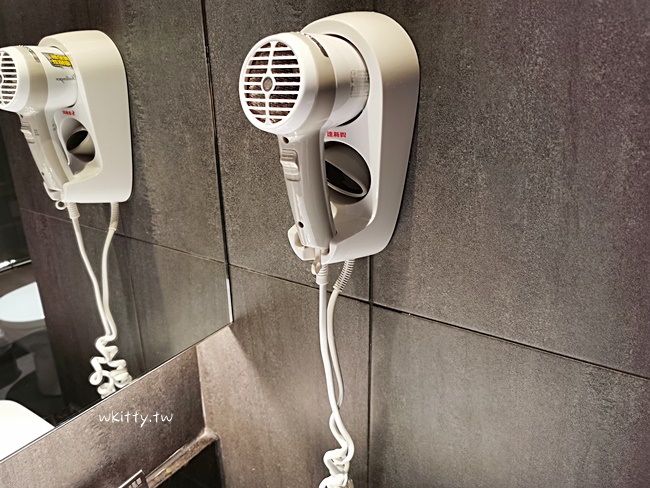
Where is `tiles on wall`? tiles on wall is located at coordinates (463, 390).